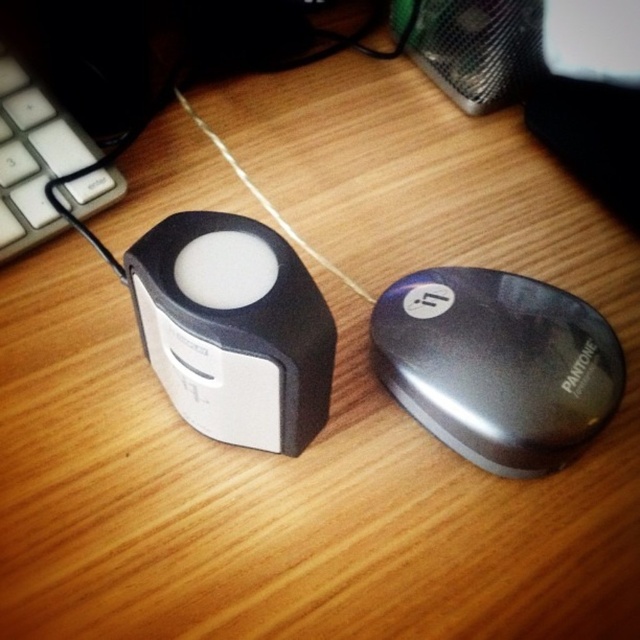
Question: Can you confirm if matte black speaker at center is wider than white matte string at center?

Choices:
 (A) yes
 (B) no

Answer: (B)

Question: Which of these objects is positioned closest to the white matte string at center?

Choices:
 (A) satin black mouse at center
 (B) white plastic keyboard at left

Answer: (A)

Question: Does satin black mouse at center appear on the right side of matte black speaker at center?

Choices:
 (A) yes
 (B) no

Answer: (A)

Question: Which point is closer to the camera?

Choices:
 (A) white plastic keyboard at left
 (B) matte black speaker at center

Answer: (B)

Question: Is satin black mouse at center bigger than white matte string at center?

Choices:
 (A) yes
 (B) no

Answer: (B)

Question: Which point appears closest to the camera in this image?

Choices:
 (A) (294, 234)
 (B) (28, 186)

Answer: (B)